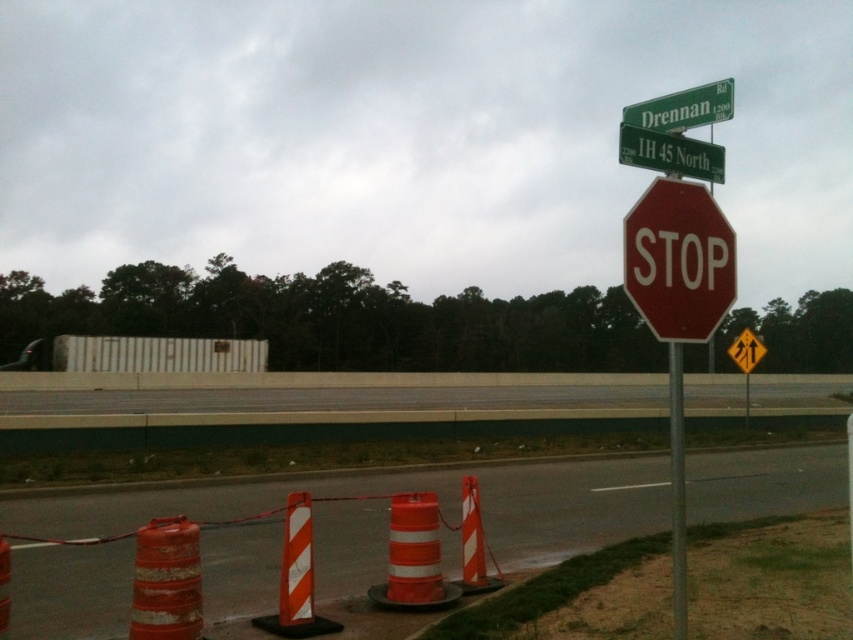
Question: Does green metallic street sign at upper center appear over green plastic street sign at upper center?

Choices:
 (A) yes
 (B) no

Answer: (B)

Question: From the image, what is the correct spatial relationship of rusty orange traffic cone at lower left in relation to green metallic street sign at upper center?

Choices:
 (A) above
 (B) below

Answer: (B)

Question: Which of the following is the closest to the observer?

Choices:
 (A) (712, 307)
 (B) (679, 536)

Answer: (B)

Question: Estimate the real-world distances between objects in this image. Which object is farther from the red glossy stop sign at center?

Choices:
 (A) orange reflective cone at center
 (B) orange reflective cones at lower center

Answer: (A)

Question: Does orange reflective cone at lower center have a larger size compared to orange reflective cone at center?

Choices:
 (A) yes
 (B) no

Answer: (A)

Question: Which object is the farthest from the red glossy stop sign at center?

Choices:
 (A) orange reflective traffic cone at lower center
 (B) metallic pole at center

Answer: (B)